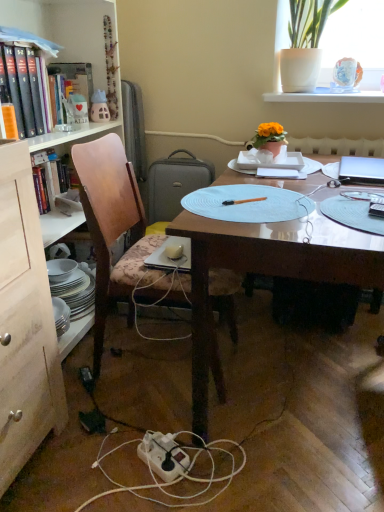
Describe the element at coordinates (28, 83) in the screenshot. I see `orange matte book at left, marked as the second book in a back-to-front arrangement` at that location.

This screenshot has width=384, height=512. What do you see at coordinates (268, 270) in the screenshot?
I see `wooden desk at center` at bounding box center [268, 270].

In order to face white plastic power plugs and sockets at lower center, which appears as the 1th power plugs and sockets when viewed from the front, should I rotate leftwards or rightwards?

It's best to rotate left around 13.151 degrees.

At what (x,y) coordinates should I click in order to perform the action: click on wooden bookcase at left. Please return your answer as a coordinate pair (x, y). This screenshot has height=512, width=384. Looking at the image, I should click on [67, 28].

Describe the element at coordinates (248, 203) in the screenshot. I see `light blue paper plate at center` at that location.

Where is `orange matte book at left, marked as the second book in a back-to-front arrangement`? This screenshot has height=512, width=384. orange matte book at left, marked as the second book in a back-to-front arrangement is located at coordinates (28, 83).

From a real-world perspective, is clear plastic pen at center located higher than wooden bookcase at left?

Indeed, from a real-world perspective, clear plastic pen at center stands above wooden bookcase at left.

Is the depth of clear plastic pen at center greater than that of wooden bookcase at left?

Yes.

Who is taller, clear plastic pen at center or wooden bookcase at left?

wooden bookcase at left.

Locate an element on the screen. The height and width of the screenshot is (512, 384). bookcase lying above the clear plastic pen at center (from the image's perspective) is located at coordinates (67, 28).

From a real-world perspective, relative to wooden bookcase at left, is wooden chair at left vertically above or below?

Clearly, from a real-world perspective, wooden chair at left is below wooden bookcase at left.

Is wooden chair at left bigger than wooden bookcase at left?

No, wooden chair at left is not bigger than wooden bookcase at left.

Which is nearer, (104, 298) or (90, 31)?

The point (104, 298) is in front.

Is wooden bookcase at left completely or partially inside wooden chair at left?

No, wooden bookcase at left is not a part of wooden chair at left.

Is point (93, 89) farther from viewer compared to point (88, 390)?

Yes, it is.

Is matte plastic cup at upper left, which is counted as the second book, starting from the front, positioned with its back to black plastic power plugs and sockets at lower left, the 2th power plugs and sockets from the front?

No, black plastic power plugs and sockets at lower left, the 2th power plugs and sockets from the front, is not at the back of matte plastic cup at upper left, which is counted as the second book, starting from the front.

Choose the correct answer: Is matte plastic cup at upper left, which is the 1th book from back to front, inside black plastic power plugs and sockets at lower left, which is counted as the 2th power plugs and sockets, starting from the bottom, or outside it?

The correct answer is: outside.

How different are the orientations of matte plastic cup at upper left, which is counted as the second book, starting from the front, and black plastic power plugs and sockets at lower left, the 2th power plugs and sockets from the front, in degrees?

There is a 54.7-degree angle between the facing directions of matte plastic cup at upper left, which is counted as the second book, starting from the front, and black plastic power plugs and sockets at lower left, the 2th power plugs and sockets from the front.

Who is more distant, wooden bookcase at left or silver metallic laptop at upper right?

silver metallic laptop at upper right is further away from the camera.

Is wooden bookcase at left outside of silver metallic laptop at upper right?

That's correct, wooden bookcase at left is outside of silver metallic laptop at upper right.

From the picture: Is wooden bookcase at left shorter than silver metallic laptop at upper right?

Incorrect, the height of wooden bookcase at left does not fall short of that of silver metallic laptop at upper right.

Find the location of a particular element. The width and height of the screenshot is (384, 512). power outlet lying in front of the clear plastic pen at center is located at coordinates (163, 455).

Does point (167, 479) lie in front of point (350, 198)?

Yes, it is in front of point (350, 198).

Does white plastic power outlet at lower center come in front of clear plastic pen at center?

Yes.

From a real-world perspective, is black plastic power plugs and sockets at lower left, which is counted as the 2th power plugs and sockets, starting from the bottom, positioned above or below white plastic power outlet at lower center?

Clearly, from a real-world perspective, black plastic power plugs and sockets at lower left, which is counted as the 2th power plugs and sockets, starting from the bottom, is above white plastic power outlet at lower center.

Considering the positions of points (90, 376) and (174, 443), is point (90, 376) closer to camera compared to point (174, 443)?

No, it is not.

Is black plastic power plugs and sockets at lower left, the 2th power plugs and sockets from the front, outside of white plastic power outlet at lower center?

black plastic power plugs and sockets at lower left, the 2th power plugs and sockets from the front, lies outside white plastic power outlet at lower center's area.

In the scene shown: Could you tell me if matte plastic cup at upper left, which is the 1th book from back to front, is turned towards silver metallic laptop at upper right?

No, matte plastic cup at upper left, which is the 1th book from back to front, does not turn towards silver metallic laptop at upper right.

Looking at this image, which object is wider, matte plastic cup at upper left, which is the 1th book from back to front, or silver metallic laptop at upper right?

silver metallic laptop at upper right is wider.

Is matte plastic cup at upper left, which is the 1th book from back to front, in front of or behind silver metallic laptop at upper right in the image?

Clearly, matte plastic cup at upper left, which is the 1th book from back to front, is behind silver metallic laptop at upper right.

Identify the location of bookcase above the clear plastic pen at center (from the image's perspective). Image resolution: width=384 pixels, height=512 pixels. (67, 28).

This screenshot has width=384, height=512. Find the location of `bookcase positioned vertically above the wooden chair at left (from a real-world perspective)`. bookcase positioned vertically above the wooden chair at left (from a real-world perspective) is located at coordinates (67, 28).

Which object lies nearer to the anchor point orange matte book at left, positioned as the first book in front-to-back order, white plastic power plugs and sockets at lower center, which appears as the 1th power plugs and sockets when ordered from the bottom, or light blue paper plate at center?

light blue paper plate at center is positioned closer to the anchor orange matte book at left, positioned as the first book in front-to-back order.

From the image, which object appears to be farther from white ceramic pot at upper right, clear plastic pen at center or light blue paper plate at center?

light blue paper plate at center is further to white ceramic pot at upper right.

Looking at this image, based on their spatial positions, is black plastic power plugs and sockets at lower left, which appears as the 1th power plugs and sockets when viewed from the back, or white ceramic pot at upper right closer to silver metallic laptop at upper right?

white ceramic pot at upper right.

Which object lies further to the anchor point silver metallic laptop at upper right, wooden chair at left or white plastic power outlet at lower center?

white plastic power outlet at lower center is positioned further to the anchor silver metallic laptop at upper right.

From the image, which object appears to be nearer to orange matte book at left, marked as the second book in a back-to-front arrangement, matte plastic cup at upper left, which is counted as the second book, starting from the front, or white plastic power plugs and sockets at lower center, which ranks as the 2th power plugs and sockets in top-to-bottom order?

Among the two, matte plastic cup at upper left, which is counted as the second book, starting from the front, is located nearer to orange matte book at left, marked as the second book in a back-to-front arrangement.

When comparing their distances from white ceramic pot at upper right, does matte plastic cup at upper left, which is the 1th book from back to front, or black plastic power plugs and sockets at lower left, the 2th power plugs and sockets from the front, seem closer?

The object closer to white ceramic pot at upper right is matte plastic cup at upper left, which is the 1th book from back to front.

Based on their spatial positions, is white ceramic pot at upper right or white plastic power outlet at lower center further from light blue paper plate at center?

Among the two, white ceramic pot at upper right is located further to light blue paper plate at center.

When comparing their distances from light blue paper plate at center, does wooden chair at left or wooden desk at center seem further?

wooden chair at left is positioned further to the anchor light blue paper plate at center.

Identify the location of bookcase between white ceramic pot at upper right and white plastic power outlet at lower center vertically. Image resolution: width=384 pixels, height=512 pixels. (67, 28).

Image resolution: width=384 pixels, height=512 pixels. Find the location of `power plugs and sockets between white ceramic pot at upper right and white plastic power plugs and sockets at lower center, which ranks as the 2th power plugs and sockets in top-to-bottom order, vertically`. power plugs and sockets between white ceramic pot at upper right and white plastic power plugs and sockets at lower center, which ranks as the 2th power plugs and sockets in top-to-bottom order, vertically is located at coordinates (87, 379).

Where is `toy between light blue paper plate at center and matte plastic cup at upper left, which is the 1th book from back to front, from front to back`? The height and width of the screenshot is (512, 384). toy between light blue paper plate at center and matte plastic cup at upper left, which is the 1th book from back to front, from front to back is located at coordinates (99, 106).

Identify the location of chair between matte plastic cup at upper left, which is the 1th book from back to front, and black plastic power plugs and sockets at lower left, which appears as the 1th power plugs and sockets when viewed from the top, in the vertical direction. click(x=119, y=234).